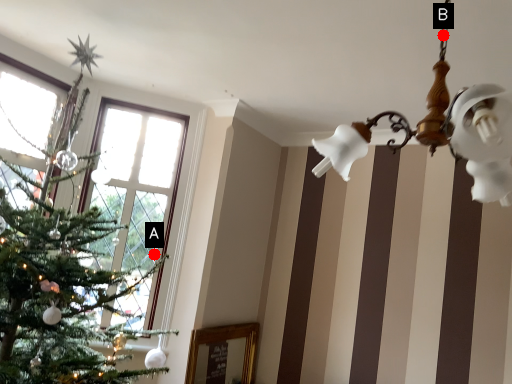
Question: Two points are circled on the image, labeled by A and B beside each circle. Which of the following is the closest to the observer?

Choices:
 (A) A is closer
 (B) B is closer

Answer: (B)